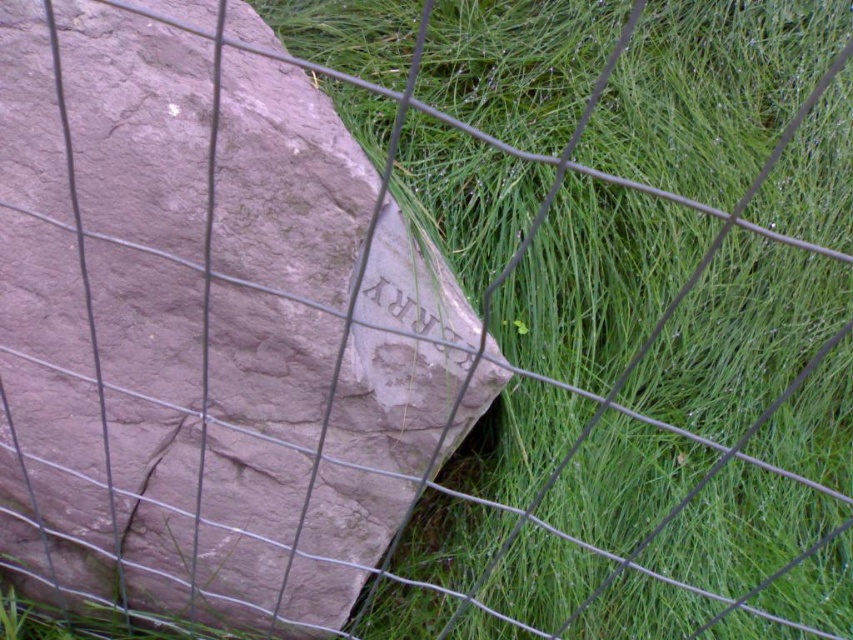
You are standing in a garden and see the green grass at center and the rustic stone boulder at center. Which object is located to the right of the other?

The green grass at center is positioned on the right side of rustic stone boulder at center, so the green grass at center is to the right of the rustic stone boulder at center.

You are standing in a garden and see green grass at center and rustic stone boulder at center. Which object is on top of the other?

The green grass at center is positioned over rustic stone boulder at center, so the green grass at center is on top of the rustic stone boulder at center.